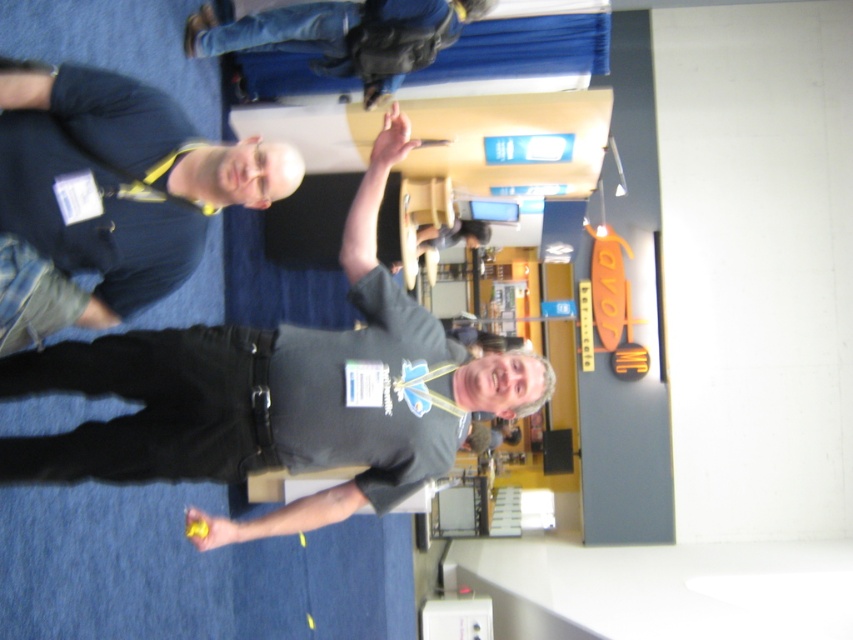
Question: Observing the image, what is the correct spatial positioning of dark blue shirt at left in reference to smooth gray shirt at center?

Choices:
 (A) above
 (B) below

Answer: (B)

Question: Which is nearer to the smooth gray shirt at center?

Choices:
 (A) matte black lift at center
 (B) jeans at upper center
 (C) dark blue shirt at left

Answer: (A)

Question: Is smooth gray shirt at center thinner than matte black lift at center?

Choices:
 (A) no
 (B) yes

Answer: (A)

Question: Which point is closer to the camera taking this photo?

Choices:
 (A) (482, 234)
 (B) (514, 220)
 (C) (288, 32)
 (D) (4, 88)

Answer: (D)

Question: Considering the relative positions of dark blue shirt at left and smooth gray shirt at center in the image provided, where is dark blue shirt at left located with respect to smooth gray shirt at center?

Choices:
 (A) left
 (B) right

Answer: (A)

Question: Among these objects, which one is nearest to the camera?

Choices:
 (A) matte black lift at center
 (B) jeans at upper center

Answer: (B)